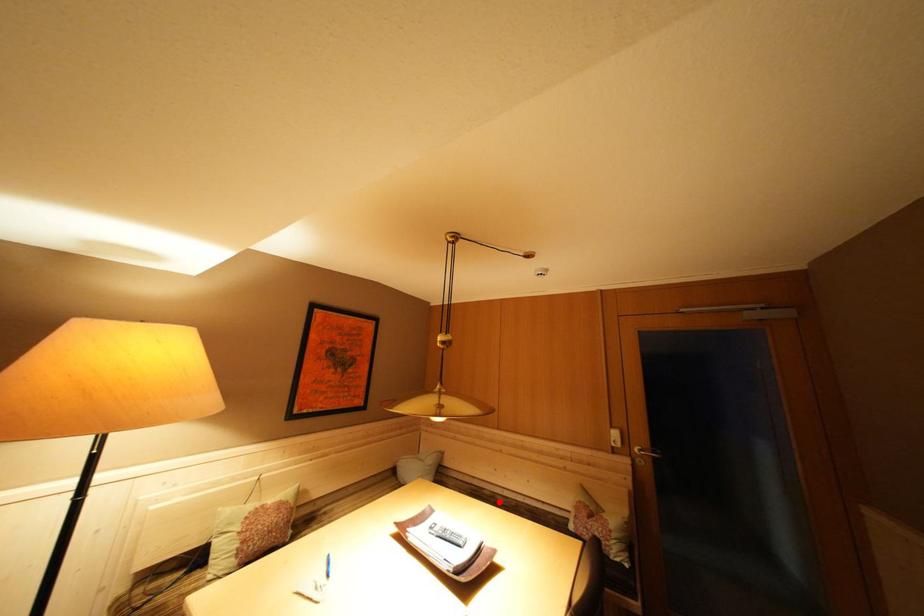
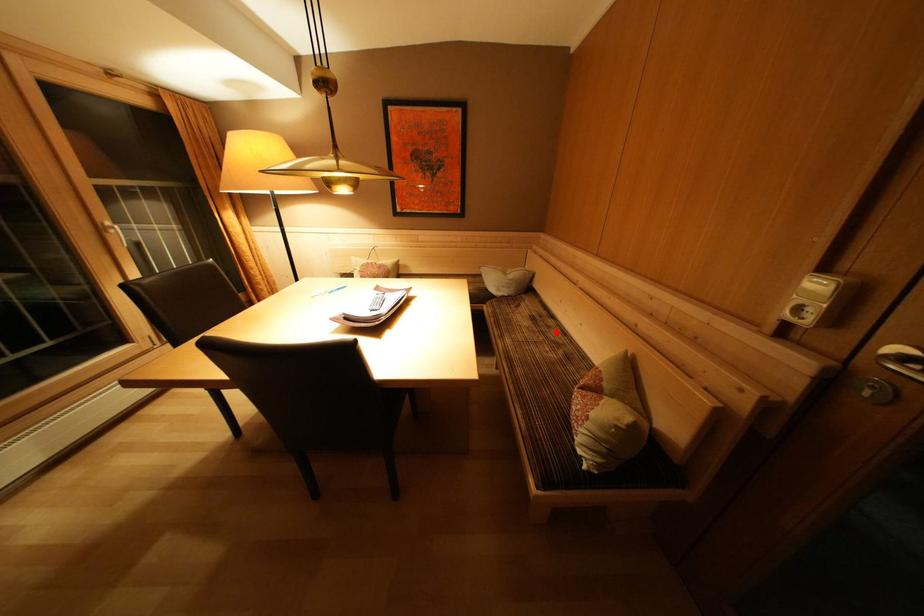
I am providing you with two images of the same scene from different viewpoints. A red point is marked on the first image and another point is marked on the second image. Is the marked point in image1 the same physical position as the marked point in image2?

Yes